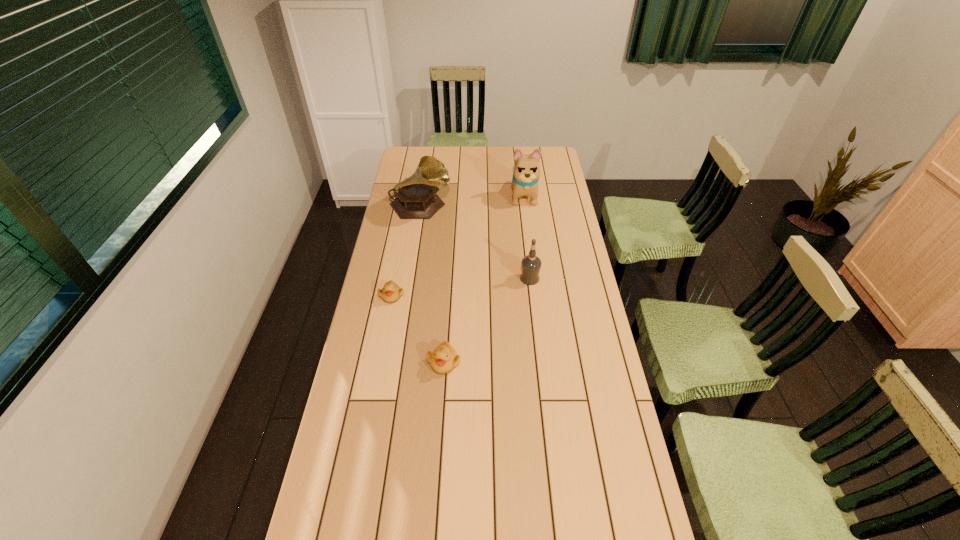
Identify the location of free space that is in between the farther duckling and the phonograph record. Image resolution: width=960 pixels, height=540 pixels. click(x=406, y=251).

This screenshot has width=960, height=540. Identify the location of free space between the phonograph record and the puppy. (472, 201).

The width and height of the screenshot is (960, 540). I want to click on free area in between the right duckling and the puppy, so [484, 279].

Locate an element on the screen. object that is the fourth closest to the farther duckling is located at coordinates (526, 173).

Find the location of a particular element. object identified as the closest to the fourth farthest object is located at coordinates pos(443,359).

Locate an element on the screen. This screenshot has height=540, width=960. free space that satisfies the following two spatial constraints: 1. on the front label of the third farthest object; 2. on the front-facing side of the nearest object is located at coordinates (540, 362).

Identify the location of blank area in the image that satisfies the following two spatial constraints: 1. on the face of the puppy; 2. on the front label of the third shortest object. (534, 279).

The width and height of the screenshot is (960, 540). Identify the location of blank area in the image that satisfies the following two spatial constraints: 1. on the horn direction of the phonograph record; 2. at the beak of the farther duckling. (406, 295).

In order to click on blank area in the image that satisfies the following two spatial constraints: 1. on the face of the puppy; 2. on the horn direction of the phonograph record in this screenshot , I will do `click(525, 207)`.

Locate an element on the screen. The width and height of the screenshot is (960, 540). vacant space that satisfies the following two spatial constraints: 1. on the horn direction of the phonograph record; 2. at the beak of the left duckling is located at coordinates (406, 295).